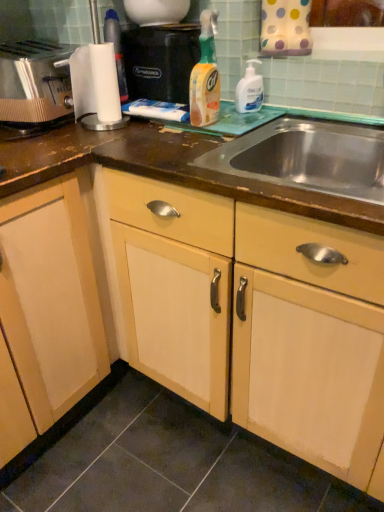
Question: Looking at their shapes, would you say matte wood cabinet at center is wider or thinner than translucent plastic spray bottle at center, arranged as the first cleaning product when viewed from the left?

Choices:
 (A) thin
 (B) wide

Answer: (B)

Question: Would you say matte wood cabinet at center is to the left or to the right of translucent plastic spray bottle at center, arranged as the first cleaning product when viewed from the left, in the picture?

Choices:
 (A) right
 (B) left

Answer: (B)

Question: Which is farther from the white glossy pump bottle at upper right, acting as the 1th cleaning product starting from the right?

Choices:
 (A) brushed metal toaster at left
 (B) translucent plastic spray bottle at center, which is the second cleaning product from right to left
 (C) matte wood cabinet at center
 (D) black plastic coffee machine at upper center
 (E) stainless steel sink at center

Answer: (C)

Question: Estimate the real-world distances between objects in this image. Which object is farther from the matte wood cabinet at center?

Choices:
 (A) black plastic coffee machine at upper center
 (B) stainless steel sink at center
 (C) brushed metal toaster at left
 (D) translucent plastic spray bottle at center, arranged as the first cleaning product when viewed from the left
 (E) white glossy pump bottle at upper right, which ranks as the 2th cleaning product in left-to-right order

Answer: (C)